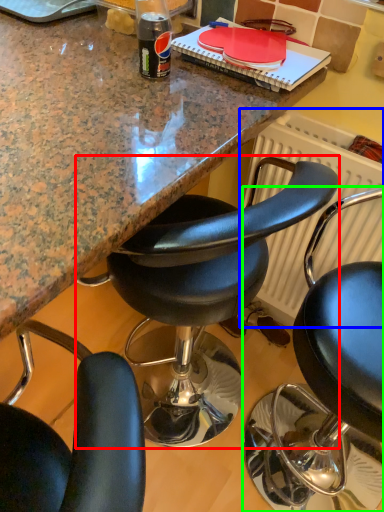
Question: Which object is the farthest from chair (highlighted by a red box)? Choose among these: radiator (highlighted by a blue box) or chair (highlighted by a green box).

Choices:
 (A) radiator
 (B) chair

Answer: (B)